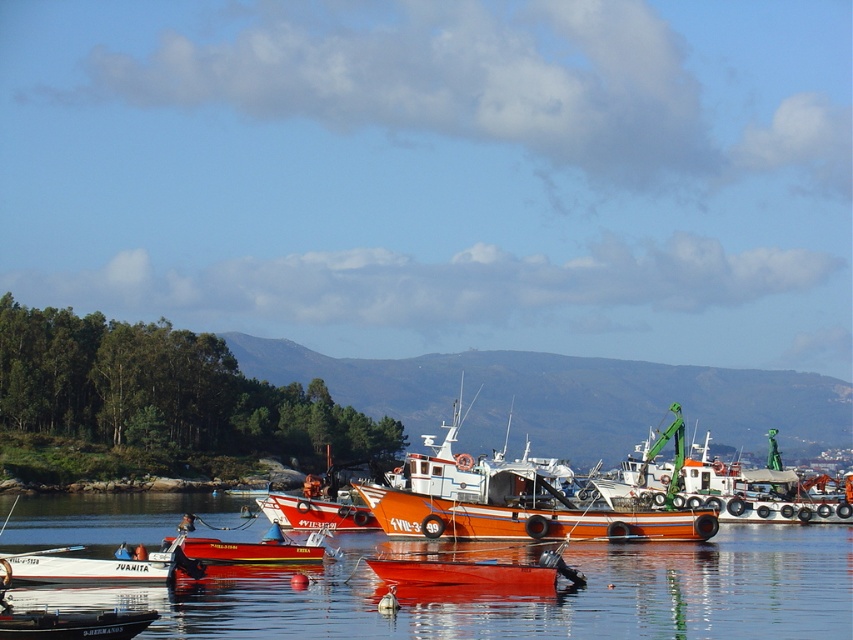
Question: Does glossy water at center appear over orange matte fishing boat at center?

Choices:
 (A) yes
 (B) no

Answer: (B)

Question: Does glossy water at center appear on the left side of orange matte fishing boat at center?

Choices:
 (A) no
 (B) yes

Answer: (B)

Question: In this image, where is glossy water at center located relative to orange matte fishing boat at center?

Choices:
 (A) left
 (B) right

Answer: (A)

Question: Which object appears farthest from the camera in this image?

Choices:
 (A) glossy water at center
 (B) orange matte fishing boat at center

Answer: (B)

Question: Among these points, which one is farthest from the camera?

Choices:
 (A) (380, 502)
 (B) (32, 604)

Answer: (A)